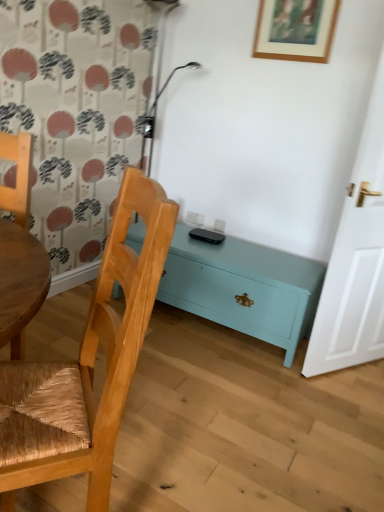
Where is `wooden picture frame at upper center`? The image size is (384, 512). wooden picture frame at upper center is located at coordinates (295, 29).

Measure the distance between wooden picture frame at upper center and camera.

They are 7.34 feet apart.

Describe the element at coordinates (87, 362) in the screenshot. I see `woven wood chair at left, the second chair from the left` at that location.

Find the location of a particular element. The width and height of the screenshot is (384, 512). wooden woven chair at left, positioned as the second chair in right-to-left order is located at coordinates (19, 251).

Considering the relative sizes of wooden woven chair at left, which ranks as the first chair in left-to-right order, and woven wood chair at left, the second chair from the left, in the image provided, is wooden woven chair at left, which ranks as the first chair in left-to-right order, taller than woven wood chair at left, the second chair from the left,?

In fact, wooden woven chair at left, which ranks as the first chair in left-to-right order, may be shorter than woven wood chair at left, the second chair from the left.

Which is closer to the camera, (20, 245) or (71, 448)?

Point (20, 245) appears to be farther away from the viewer than point (71, 448).

Relative to woven wood chair at left, which ranks as the first chair in right-to-left order, is wooden woven chair at left, which ranks as the first chair in left-to-right order, in front or behind?

Visually, wooden woven chair at left, which ranks as the first chair in left-to-right order, is located behind woven wood chair at left, which ranks as the first chair in right-to-left order.

Can you tell me how much wooden woven chair at left, positioned as the second chair in right-to-left order, and woven wood chair at left, which ranks as the first chair in right-to-left order, differ in facing direction?

71.3 degrees.

Is white wooden door at right positioned with its back to teal painted wood chest at lower center?

No, white wooden door at right's orientation is not away from teal painted wood chest at lower center.

Is white wooden door at right not near teal painted wood chest at lower center?

No, there isn't a large distance between white wooden door at right and teal painted wood chest at lower center.

Relative to teal painted wood chest at lower center, is white wooden door at right in front or behind?

white wooden door at right is positioned closer to the viewer than teal painted wood chest at lower center.

From the picture: From a real-world perspective, is woven wood chair at left, the second chair from the left, physically above wooden picture frame at upper center?

Incorrect, from a real-world perspective, woven wood chair at left, the second chair from the left, is lower than wooden picture frame at upper center.

From the image's perspective, does woven wood chair at left, which ranks as the first chair in right-to-left order, appear higher than wooden picture frame at upper center?

No, from the image's perspective, woven wood chair at left, which ranks as the first chair in right-to-left order, is not above wooden picture frame at upper center.

Based on the photo, what's the angular difference between woven wood chair at left, the second chair from the left, and wooden picture frame at upper center's facing directions?

They differ by 43 degrees in their facing directions.

Can you confirm if woven wood chair at left, the second chair from the left, is bigger than wooden picture frame at upper center?

Indeed, woven wood chair at left, the second chair from the left, has a larger size compared to wooden picture frame at upper center.

Does woven wood chair at left, which ranks as the first chair in right-to-left order, have a larger size compared to wooden woven chair at left, which ranks as the first chair in left-to-right order?

Indeed, woven wood chair at left, which ranks as the first chair in right-to-left order, has a larger size compared to wooden woven chair at left, which ranks as the first chair in left-to-right order.

Can you tell me how much woven wood chair at left, which ranks as the first chair in right-to-left order, and wooden woven chair at left, positioned as the second chair in right-to-left order, differ in facing direction?

71.3 degrees.

Is woven wood chair at left, the second chair from the left, shorter than wooden woven chair at left, which ranks as the first chair in left-to-right order?

No.

Which of these two, woven wood chair at left, which ranks as the first chair in right-to-left order, or wooden woven chair at left, which ranks as the first chair in left-to-right order, is thinner?

Thinner between the two is woven wood chair at left, which ranks as the first chair in right-to-left order.

Locate an element on the screen. nightstand located below the wooden picture frame at upper center (from the image's perspective) is located at coordinates (244, 288).

Does wooden picture frame at upper center appear on the left side of teal painted wood chest at lower center?

Answer: No.

From a real-world perspective, is wooden picture frame at upper center located higher than teal painted wood chest at lower center?

Yes, from a real-world perspective, wooden picture frame at upper center is over teal painted wood chest at lower center

You are a GUI agent. You are given a task and a screenshot of the screen. Output one action in this format:
    pyautogui.click(x=<x>, y=<y>)
    Task: Click on the nightstand below the white wooden door at right (from the image's perspective)
    The width and height of the screenshot is (384, 512).
    Given the screenshot: What is the action you would take?
    pyautogui.click(x=244, y=288)

Does teal painted wood chest at lower center have a lesser width compared to white wooden door at right?

No, teal painted wood chest at lower center is not thinner than white wooden door at right.

Is teal painted wood chest at lower center in contact with white wooden door at right?

No, teal painted wood chest at lower center is not next to white wooden door at right.

Is wooden woven chair at left, which ranks as the first chair in left-to-right order, beside wooden picture frame at upper center?

No, wooden woven chair at left, which ranks as the first chair in left-to-right order, is not beside wooden picture frame at upper center.

Considering the sizes of objects wooden woven chair at left, positioned as the second chair in right-to-left order, and wooden picture frame at upper center in the image provided, who is wider, wooden woven chair at left, positioned as the second chair in right-to-left order, or wooden picture frame at upper center?

Wider between the two is wooden woven chair at left, positioned as the second chair in right-to-left order.

Which object is positioned more to the left, wooden woven chair at left, positioned as the second chair in right-to-left order, or wooden picture frame at upper center?

wooden woven chair at left, positioned as the second chair in right-to-left order.

Image resolution: width=384 pixels, height=512 pixels. I want to click on picture frame above the wooden woven chair at left, which ranks as the first chair in left-to-right order (from the image's perspective), so click(x=295, y=29).

The width and height of the screenshot is (384, 512). Find the location of `chair that is behind the woven wood chair at left, which ranks as the first chair in right-to-left order`. chair that is behind the woven wood chair at left, which ranks as the first chair in right-to-left order is located at coordinates (19, 251).

Identify the location of nightstand on the left of white wooden door at right. (244, 288).

Which object lies further to the anchor point wooden picture frame at upper center, woven wood chair at left, which ranks as the first chair in right-to-left order, or teal painted wood chest at lower center?

Based on the image, woven wood chair at left, which ranks as the first chair in right-to-left order, appears to be further to wooden picture frame at upper center.

When comparing their distances from wooden picture frame at upper center, does woven wood chair at left, which ranks as the first chair in right-to-left order, or white wooden door at right seem closer?

white wooden door at right is closer to wooden picture frame at upper center.

From the image, which object appears to be farther from teal painted wood chest at lower center, woven wood chair at left, which ranks as the first chair in right-to-left order, or wooden picture frame at upper center?

wooden picture frame at upper center is further to teal painted wood chest at lower center.

Based on their spatial positions, is white wooden door at right or woven wood chair at left, the second chair from the left, closer to teal painted wood chest at lower center?

white wooden door at right is closer to teal painted wood chest at lower center.

Based on the photo, when comparing their distances from white wooden door at right, does wooden picture frame at upper center or woven wood chair at left, the second chair from the left, seem closer?

wooden picture frame at upper center is closer to white wooden door at right.

Based on their spatial positions, is woven wood chair at left, the second chair from the left, or teal painted wood chest at lower center further from wooden woven chair at left, positioned as the second chair in right-to-left order?

teal painted wood chest at lower center is positioned further to the anchor wooden woven chair at left, positioned as the second chair in right-to-left order.

Considering their positions, is wooden woven chair at left, positioned as the second chair in right-to-left order, positioned further to wooden picture frame at upper center than woven wood chair at left, which ranks as the first chair in right-to-left order?

woven wood chair at left, which ranks as the first chair in right-to-left order, is positioned further to the anchor wooden picture frame at upper center.

When comparing their distances from teal painted wood chest at lower center, does wooden picture frame at upper center or white wooden door at right seem further?

wooden picture frame at upper center is positioned further to the anchor teal painted wood chest at lower center.

The width and height of the screenshot is (384, 512). What are the coordinates of `nightstand between wooden picture frame at upper center and woven wood chair at left, which ranks as the first chair in right-to-left order, in the up-down direction` in the screenshot? It's located at click(x=244, y=288).

The height and width of the screenshot is (512, 384). In order to click on chair between wooden picture frame at upper center and woven wood chair at left, the second chair from the left, in the vertical direction in this screenshot , I will do `click(19, 251)`.

Identify the location of picture frame between wooden woven chair at left, which ranks as the first chair in left-to-right order, and white wooden door at right from left to right. (295, 29).

Find the location of a particular element. Image resolution: width=384 pixels, height=512 pixels. door between wooden picture frame at upper center and woven wood chair at left, which ranks as the first chair in right-to-left order, vertically is located at coordinates point(355,260).